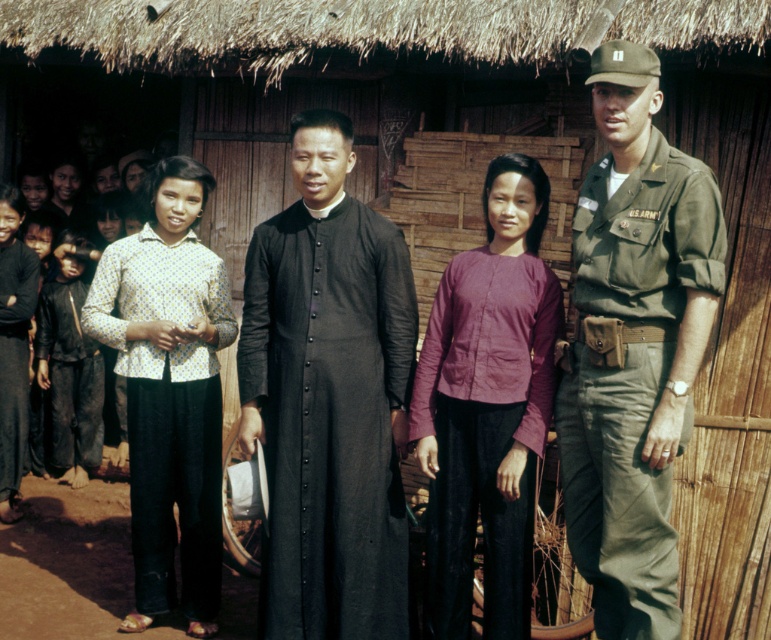
Question: Does black matte robe at center appear on the left side of olive drab uniform at right?

Choices:
 (A) no
 (B) yes

Answer: (B)

Question: Is black matte robe at center thinner than dark gray fabric pants at lower left?

Choices:
 (A) yes
 (B) no

Answer: (B)

Question: Which of these objects is positioned farthest from the yellow dotted shirt at left?

Choices:
 (A) black matte pants at lower left
 (B) black matte robe at center

Answer: (A)

Question: Which point is closer to the camera?

Choices:
 (A) purple cotton blouse at center
 (B) yellow dotted shirt at left
 (C) black matte robe at center
 (D) dark gray fabric pants at lower left

Answer: (A)

Question: Is black matte robe at center positioned in front of yellow dotted shirt at left?

Choices:
 (A) no
 (B) yes

Answer: (B)

Question: Which point is farther from the camera taking this photo?

Choices:
 (A) (73, 440)
 (B) (273, 397)
 (C) (187, 296)

Answer: (A)